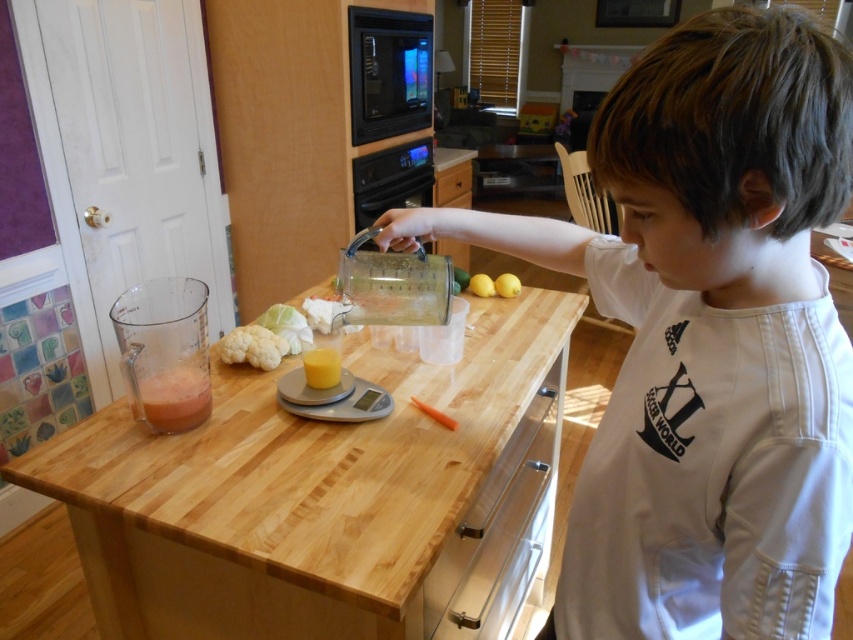
Question: Which of the following is the farthest from the observer?

Choices:
 (A) orange matte carrot at lower center
 (B) translucent plastic cup at lower left
 (C) translucent plastic cup at center
 (D) black glass microwave at upper center

Answer: (D)

Question: Does white cotton shirt at upper right lie behind translucent plastic cup at center?

Choices:
 (A) no
 (B) yes

Answer: (A)

Question: Which object is closer to the camera taking this photo?

Choices:
 (A) translucent plastic cup at lower left
 (B) black glass microwave at upper center
 (C) white matte cauliflower at lower left
 (D) wooden table at center

Answer: (D)

Question: Is white cotton shirt at upper right smaller than wooden table at center?

Choices:
 (A) no
 (B) yes

Answer: (B)

Question: Estimate the real-world distances between objects in this image. Which object is farther from the translucent plastic cup at lower left?

Choices:
 (A) wooden table at center
 (B) white cotton shirt at upper right
 (C) black glass microwave at upper center

Answer: (C)

Question: Can you confirm if white cotton shirt at upper right is wider than translucent plastic cup at center?

Choices:
 (A) no
 (B) yes

Answer: (B)